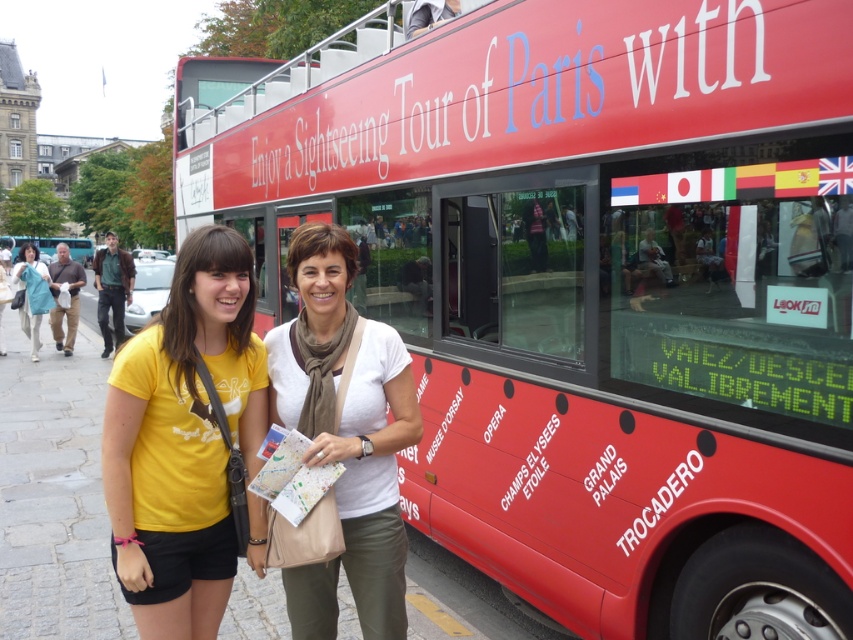
Question: Which of these objects is positioned closest to the yellow t-shirt at center?

Choices:
 (A) light blue fabric coat at left
 (B) white matte scarf at center
 (C) yellow cotton t-shirt at center

Answer: (A)

Question: Is red matte bus at center above yellow t-shirt at center?

Choices:
 (A) no
 (B) yes

Answer: (B)

Question: Which is nearer to the yellow t-shirt at center?

Choices:
 (A) white matte scarf at center
 (B) red matte bus at center
 (C) light blue fabric coat at left
 (D) yellow cotton t-shirt at center

Answer: (C)

Question: Is white matte scarf at center above yellow t-shirt at center?

Choices:
 (A) no
 (B) yes

Answer: (A)

Question: Based on their relative distances, which object is farther from the yellow t-shirt at center?

Choices:
 (A) yellow cotton t-shirt at center
 (B) red matte bus at center
 (C) light blue fabric coat at left

Answer: (B)

Question: Does yellow cotton t-shirt at center have a smaller size compared to light blue fabric coat at left?

Choices:
 (A) yes
 (B) no

Answer: (A)